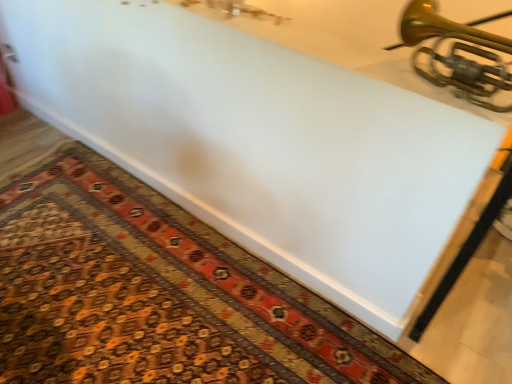
Question: Should I look upward or downward to see gold brass trumpet at upper right?

Choices:
 (A) up
 (B) down

Answer: (A)

Question: From the image's perspective, is carpeted mat at lower center under gold brass trumpet at upper right?

Choices:
 (A) no
 (B) yes

Answer: (B)

Question: Is carpeted mat at lower center far away from gold brass trumpet at upper right?

Choices:
 (A) yes
 (B) no

Answer: (A)

Question: Is carpeted mat at lower center closer to the viewer compared to gold brass trumpet at upper right?

Choices:
 (A) no
 (B) yes

Answer: (A)

Question: Can you confirm if carpeted mat at lower center is smaller than gold brass trumpet at upper right?

Choices:
 (A) no
 (B) yes

Answer: (A)

Question: Can you confirm if carpeted mat at lower center is shorter than gold brass trumpet at upper right?

Choices:
 (A) yes
 (B) no

Answer: (A)

Question: Does carpeted mat at lower center have a larger size compared to gold brass trumpet at upper right?

Choices:
 (A) no
 (B) yes

Answer: (B)

Question: Are gold brass trumpet at upper right and carpeted mat at lower center far apart?

Choices:
 (A) yes
 (B) no

Answer: (A)

Question: From the image's perspective, does gold brass trumpet at upper right appear higher than carpeted mat at lower center?

Choices:
 (A) no
 (B) yes

Answer: (B)

Question: Is gold brass trumpet at upper right at the right side of carpeted mat at lower center?

Choices:
 (A) yes
 (B) no

Answer: (A)

Question: Is gold brass trumpet at upper right directly adjacent to carpeted mat at lower center?

Choices:
 (A) no
 (B) yes

Answer: (A)

Question: From the image's perspective, is gold brass trumpet at upper right under carpeted mat at lower center?

Choices:
 (A) no
 (B) yes

Answer: (A)

Question: Is gold brass trumpet at upper right positioned in front of carpeted mat at lower center?

Choices:
 (A) yes
 (B) no

Answer: (A)

Question: In the image, is gold brass trumpet at upper right positioned in front of or behind carpeted mat at lower center?

Choices:
 (A) front
 (B) behind

Answer: (A)